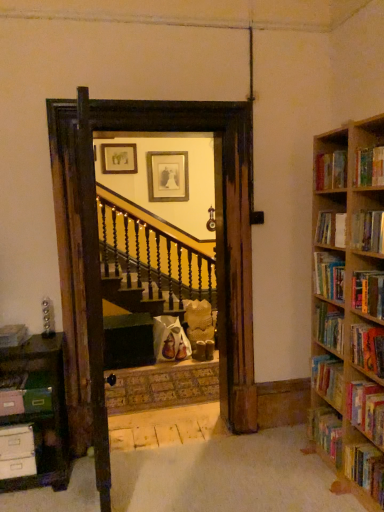
Question: Does hardcover book at right, which is the first book from right to left, come behind matte pink book at left, the 2th book when ordered from left to right?

Choices:
 (A) yes
 (B) no

Answer: (B)

Question: Can we say hardcover book at right, the twelfth book viewed from the left, lies outside matte pink book at left, the 2th book when ordered from left to right?

Choices:
 (A) yes
 (B) no

Answer: (A)

Question: From a real-world perspective, is hardcover book at right, the twelfth book viewed from the left, on matte pink book at left, the 2th book when ordered from left to right?

Choices:
 (A) no
 (B) yes

Answer: (A)

Question: Is hardcover book at right, which is the first book from right to left, not close to matte pink book at left, the 2th book when ordered from left to right?

Choices:
 (A) yes
 (B) no

Answer: (A)

Question: Can you see hardcover book at right, the twelfth book viewed from the left, touching matte pink book at left, positioned as the 11th book in right-to-left order?

Choices:
 (A) yes
 (B) no

Answer: (B)

Question: From the image's perspective, relative to matte gold picture frame at upper center, the second picture frame in the back-to-front sequence, is hardcover book at right, the 7th book in the right-to-left sequence, above or below?

Choices:
 (A) below
 (B) above

Answer: (A)

Question: Relative to matte gold picture frame at upper center, which is counted as the 2th picture frame, starting from the right, is hardcover book at right, the 7th book in the right-to-left sequence, in front or behind?

Choices:
 (A) front
 (B) behind

Answer: (A)

Question: Is hardcover book at right, placed as the 6th book when sorted from left to right, situated inside matte gold picture frame at upper center, placed as the first picture frame when sorted from front to back, or outside?

Choices:
 (A) inside
 (B) outside

Answer: (B)

Question: From a real-world perspective, relative to matte gold picture frame at upper center, which is counted as the 2th picture frame, starting from the right, is hardcover book at right, the 7th book in the right-to-left sequence, vertically above or below?

Choices:
 (A) below
 (B) above

Answer: (A)

Question: Visually, is hardcover book at upper right, the 7th book viewed from the left, positioned to the left or to the right of matte pink book at left, the 2th book when ordered from left to right?

Choices:
 (A) left
 (B) right

Answer: (B)

Question: Does point (370, 163) appear closer or farther from the camera than point (16, 414)?

Choices:
 (A) closer
 (B) farther

Answer: (A)

Question: Is hardcover book at upper right, positioned as the 6th book in right-to-left order, wider or thinner than matte pink book at left, positioned as the 11th book in right-to-left order?

Choices:
 (A) thin
 (B) wide

Answer: (A)

Question: From a real-world perspective, is hardcover book at upper right, the 7th book viewed from the left, above or below matte pink book at left, the 2th book when ordered from left to right?

Choices:
 (A) above
 (B) below

Answer: (A)

Question: Is hardcover book at right, which is the first book from right to left, inside or outside of hardcover book at right, marked as the 9th book in a left-to-right arrangement?

Choices:
 (A) inside
 (B) outside

Answer: (B)

Question: Considering the positions of hardcover book at right, which is the first book from right to left, and hardcover book at right, the 4th book viewed from the right, in the image, is hardcover book at right, which is the first book from right to left, taller or shorter than hardcover book at right, the 4th book viewed from the right,?

Choices:
 (A) short
 (B) tall

Answer: (B)